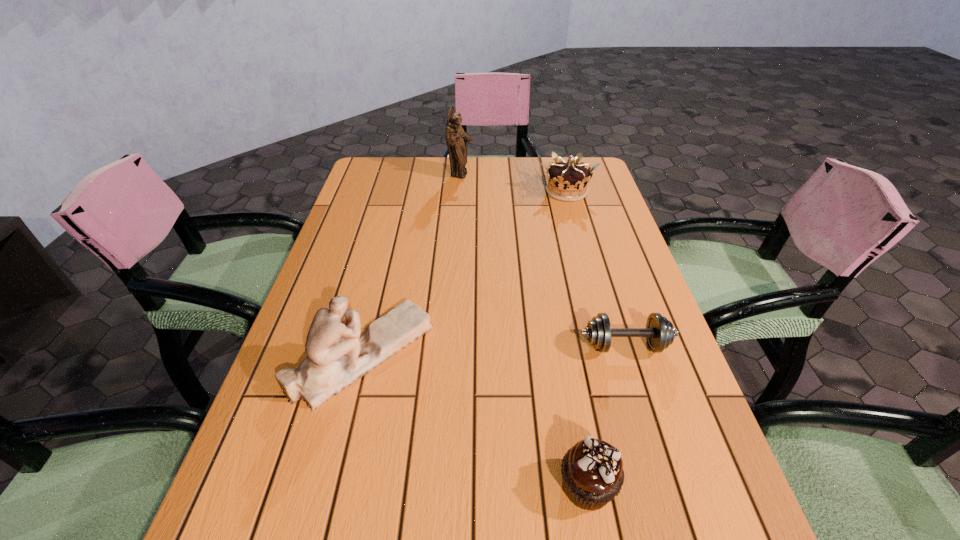
Locate an element on the screen. The image size is (960, 540). vacant space that satisfies the following two spatial constraints: 1. on the back side of the third shortest object; 2. on the front-facing side of the tallest object is located at coordinates (563, 175).

Locate an element on the screen. Image resolution: width=960 pixels, height=540 pixels. vacant region that satisfies the following two spatial constraints: 1. on the front-facing side of the fourth shortest object; 2. on the left side of the nearest object is located at coordinates (329, 485).

Where is `vacant point that satisfies the following two spatial constraints: 1. on the back side of the cupcake; 2. on the left side of the crown`? Image resolution: width=960 pixels, height=540 pixels. vacant point that satisfies the following two spatial constraints: 1. on the back side of the cupcake; 2. on the left side of the crown is located at coordinates (535, 191).